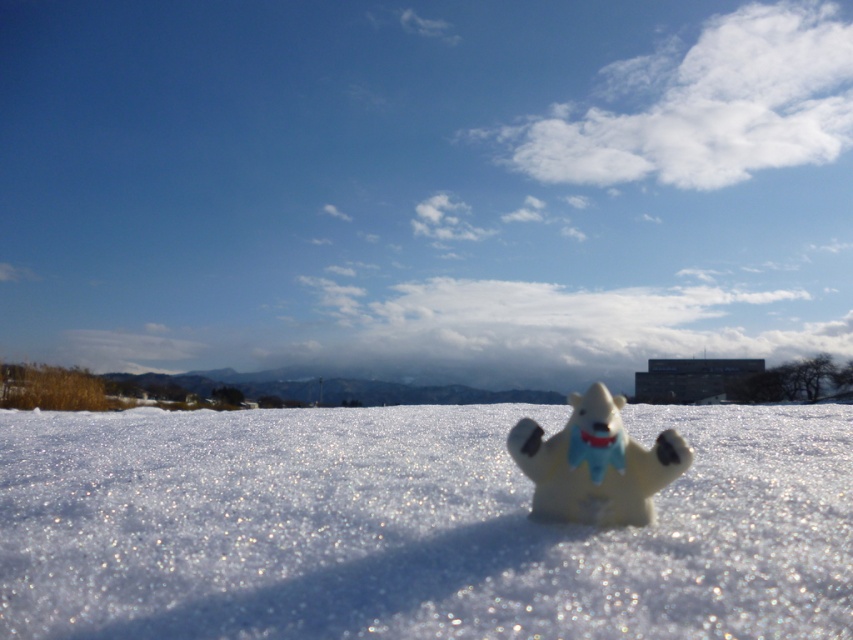
Question: Which point appears closest to the camera in this image?

Choices:
 (A) (566, 481)
 (B) (309, 452)

Answer: (A)

Question: Is white fluffy snow at center bigger than white matte polar bear at center?

Choices:
 (A) yes
 (B) no

Answer: (A)

Question: Does white fluffy snow at center have a larger size compared to white matte polar bear at center?

Choices:
 (A) no
 (B) yes

Answer: (B)

Question: Which object appears farthest from the camera in this image?

Choices:
 (A) white fluffy snow at center
 (B) white matte polar bear at center

Answer: (B)

Question: Can you confirm if white fluffy snow at center is positioned above white matte polar bear at center?

Choices:
 (A) yes
 (B) no

Answer: (B)

Question: Which of the following is the farthest from the observer?

Choices:
 (A) (70, 573)
 (B) (662, 444)

Answer: (B)